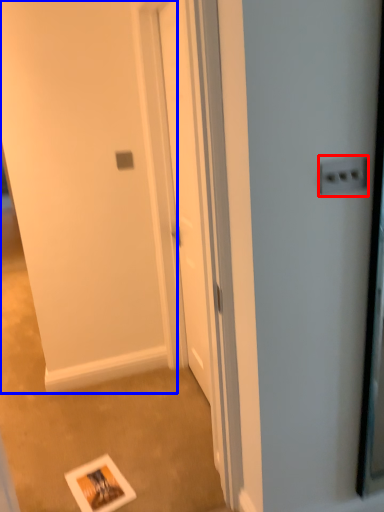
Question: Among these objects, which one is farthest to the camera, electric outlet (highlighted by a red box) or screen door (highlighted by a blue box)?

Choices:
 (A) electric outlet
 (B) screen door

Answer: (A)